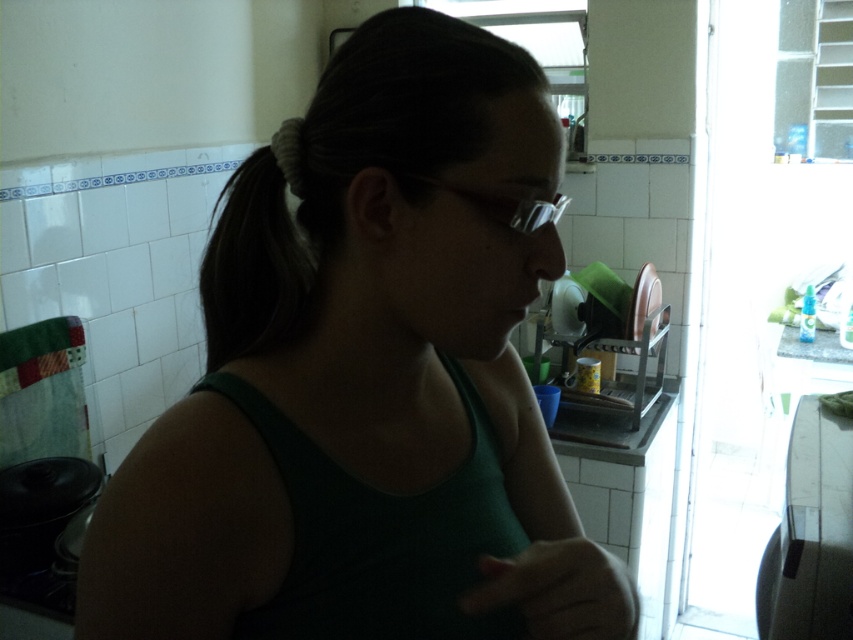
Does green matte tank top at center have a lesser width compared to green fabric hand at lower center?

Incorrect, green matte tank top at center's width is not less than green fabric hand at lower center's.

The width and height of the screenshot is (853, 640). Identify the location of green matte tank top at center. (413, 296).

Between point (370, 198) and point (570, 621), which one is positioned in front?

Point (570, 621) is more forward.

Identify the location of green matte tank top at center. This screenshot has width=853, height=640. (413, 296).

What do you see at coordinates (260, 259) in the screenshot?
I see `dark brown hair at center` at bounding box center [260, 259].

Which of these two, dark brown hair at center or green fabric hand at lower center, stands taller?

Standing taller between the two is dark brown hair at center.

Between point (247, 182) and point (608, 618), which one is positioned in front?

Point (608, 618)

At what (x,y) coordinates should I click in order to perform the action: click on dark brown hair at center. Please return your answer as a coordinate pair (x, y). Looking at the image, I should click on (260, 259).

Which is in front, point (192, 433) or point (531, 234)?

Point (192, 433) is in front.

From the picture: Does green matte tank top at center appear under transparent plastic glasses at center?

Correct, green matte tank top at center is located below transparent plastic glasses at center.

Does point (202, 433) come closer to viewer compared to point (538, 218)?

No.

At what (x,y) coordinates should I click in order to perform the action: click on green matte tank top at center. Please return your answer as a coordinate pair (x, y). This screenshot has height=640, width=853. Looking at the image, I should click on (413, 296).